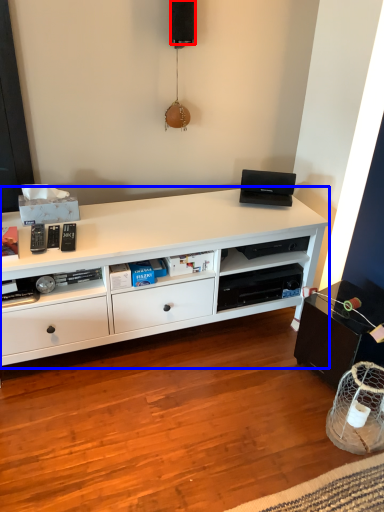
Question: Which object appears closest to the camera in this image, speaker (highlighted by a red box) or desk (highlighted by a blue box)?

Choices:
 (A) speaker
 (B) desk

Answer: (B)